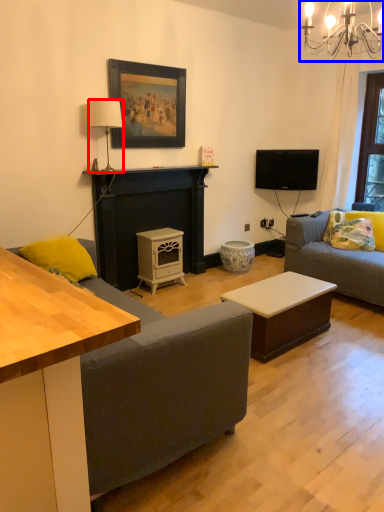
Question: Which object is further to the camera taking this photo, lamp (highlighted by a red box) or light fixture (highlighted by a blue box)?

Choices:
 (A) lamp
 (B) light fixture

Answer: (A)